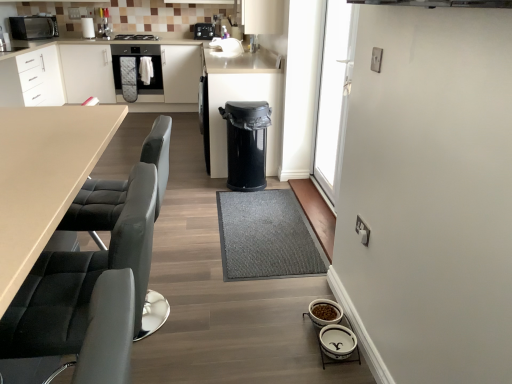
I want to click on free space between black leather swivel chair at left and black plastic trash can at center, so click(209, 231).